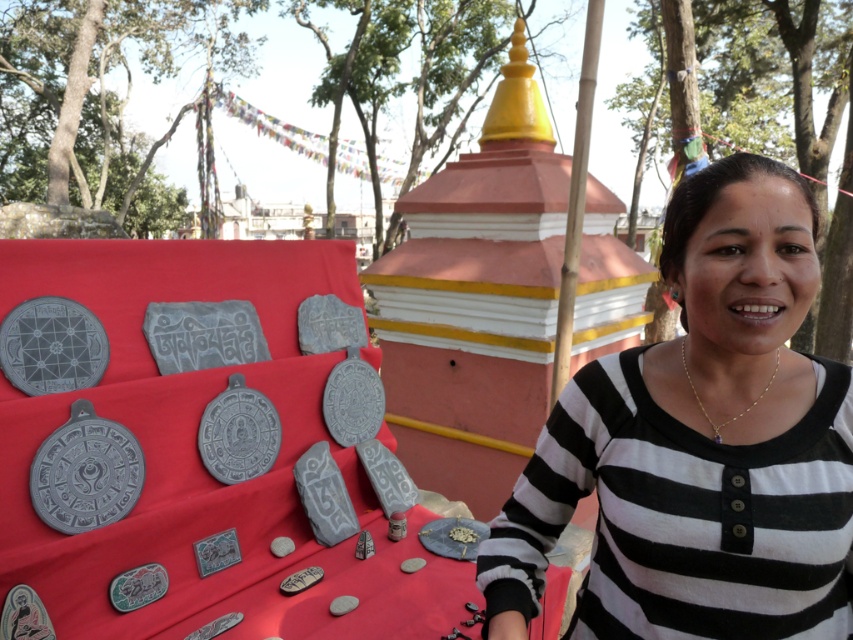
You are a photographer standing in front of the black striped shirt at right. You want to take a clear photo of it without any blur. The camera requires a minimum distance of 1 meter to focus properly. Can you take the photo from your current position?

The black striped shirt at right and viewer are 90.66 centimeters apart from each other. Since 90.66 cm is less than 1 meter, the camera cannot focus properly. You need to move back to ensure the distance is at least 1 meter.

From the picture: You are a photographer trying to capture the black striped shirt at right from the perspective of the point at [700,444]. Is the black striped shirt at right visible from this point?

Yes, the black striped shirt at right is visible from the point at [700,444] because the description states that the point lies at the location of the black striped shirt at right.